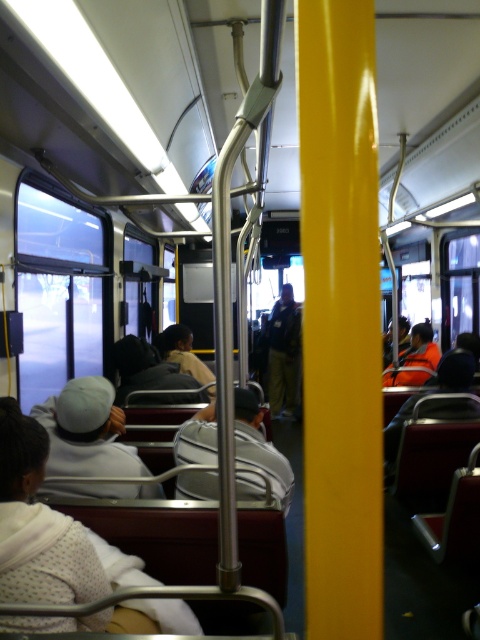
Question: Does white matte cap at center appear under orange reflective jacket at center?

Choices:
 (A) no
 (B) yes

Answer: (B)

Question: Considering the real-world distances, which object is closest to the white matte cap at center?

Choices:
 (A) dark gray leather jacket at center
 (B) gray fabric backpack at center
 (C) light brown leather jacket at center
 (D) orange reflective jacket at center

Answer: (B)

Question: Which of these objects is positioned closest to the orange reflective jacket at center?

Choices:
 (A) dark gray leather jacket at center
 (B) gray fabric backpack at center
 (C) white matte cap at center
 (D) light brown leather jacket at center

Answer: (D)

Question: Observing the image, what is the correct spatial positioning of gray fabric backpack at center in reference to light brown leather jacket at center?

Choices:
 (A) below
 (B) above

Answer: (A)

Question: Which point is closer to the camera?

Choices:
 (A) (197, 369)
 (B) (141, 497)

Answer: (B)

Question: In this image, where is white matte cap at center located relative to light brown leather jacket at center?

Choices:
 (A) right
 (B) left

Answer: (B)